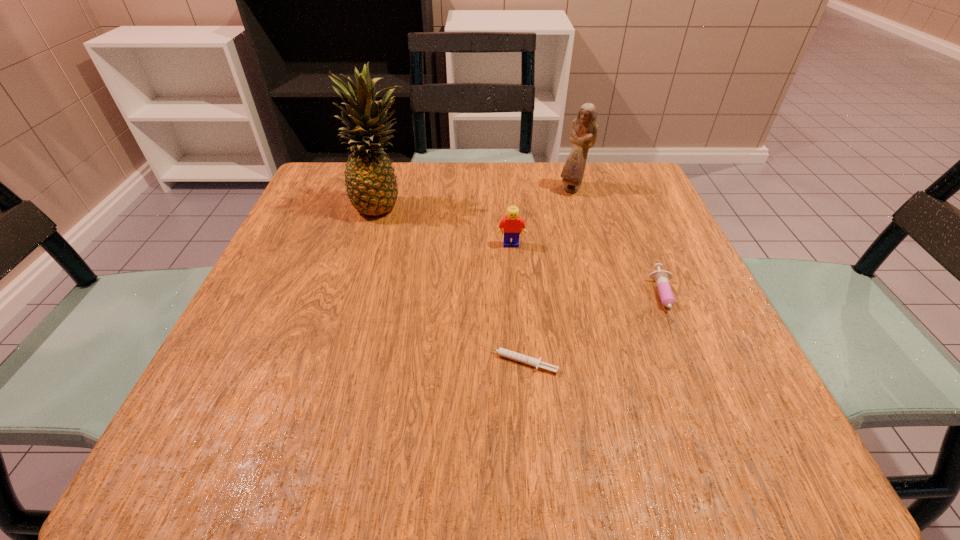
The image size is (960, 540). I want to click on free space between the second tallest object and the pineapple, so click(478, 197).

In order to click on empty space that is in between the shortest object and the figurine in this screenshot , I will do `click(545, 275)`.

You are a GUI agent. You are given a task and a screenshot of the screen. Output one action in this format:
    pyautogui.click(x=<x>, y=<y>)
    Task: Click on the free space between the third tallest object and the tallest object
    Image resolution: width=960 pixels, height=540 pixels.
    Given the screenshot: What is the action you would take?
    pyautogui.click(x=447, y=225)

What are the coordinates of `free spot between the fourth shortest object and the third shortest object` in the screenshot? It's located at (541, 217).

Identify the location of empty location between the fourth shortest object and the nearest object. (545, 275).

The image size is (960, 540). I want to click on free space between the fourth tallest object and the fourth shortest object, so pos(620,245).

You are a GUI agent. You are given a task and a screenshot of the screen. Output one action in this format:
    pyautogui.click(x=<x>, y=<y>)
    Task: Click on the vacant space in between the nearest object and the Lego
    This screenshot has height=540, width=960.
    Given the screenshot: What is the action you would take?
    pyautogui.click(x=515, y=303)

Locate an element on the screen. The height and width of the screenshot is (540, 960). free space between the shortest object and the figurine is located at coordinates (545, 275).

Locate an element on the screen. The image size is (960, 540). the closest object to the second tallest object is located at coordinates (512, 225).

Locate an element on the screen. This screenshot has width=960, height=540. object that is the fourth closest to the pineapple is located at coordinates (661, 277).